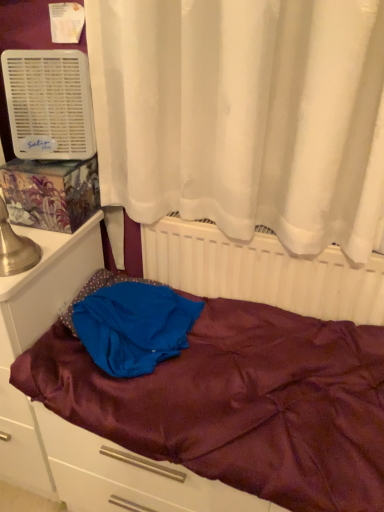
Question: Is white plastic air conditioner at upper left smaller than maroon satin bed at center?

Choices:
 (A) yes
 (B) no

Answer: (A)

Question: Can you confirm if white plastic air conditioner at upper left is taller than maroon satin bed at center?

Choices:
 (A) no
 (B) yes

Answer: (B)

Question: Is white plastic air conditioner at upper left at the right side of maroon satin bed at center?

Choices:
 (A) no
 (B) yes

Answer: (A)

Question: Is white plastic air conditioner at upper left at the left side of maroon satin bed at center?

Choices:
 (A) yes
 (B) no

Answer: (A)

Question: Is white plastic air conditioner at upper left oriented towards maroon satin bed at center?

Choices:
 (A) yes
 (B) no

Answer: (B)

Question: From the image's perspective, is white plastic radiator at center located above or below matte white file cabinet at left?

Choices:
 (A) above
 (B) below

Answer: (A)

Question: Relative to matte white file cabinet at left, is white plastic radiator at center in front or behind?

Choices:
 (A) behind
 (B) front

Answer: (A)

Question: Choose the correct answer: Is white plastic radiator at center inside matte white file cabinet at left or outside it?

Choices:
 (A) outside
 (B) inside

Answer: (A)

Question: From their relative heights in the image, would you say white plastic radiator at center is taller or shorter than matte white file cabinet at left?

Choices:
 (A) short
 (B) tall

Answer: (A)

Question: Do you think white plastic air conditioner at upper left is within blue satin blanket at center, or outside of it?

Choices:
 (A) inside
 (B) outside

Answer: (B)

Question: Is white plastic air conditioner at upper left in front of or behind blue satin blanket at center in the image?

Choices:
 (A) front
 (B) behind

Answer: (B)

Question: From the image's perspective, is white plastic air conditioner at upper left located above or below blue satin blanket at center?

Choices:
 (A) above
 (B) below

Answer: (A)

Question: Looking at their shapes, would you say white plastic air conditioner at upper left is wider or thinner than blue satin blanket at center?

Choices:
 (A) thin
 (B) wide

Answer: (A)

Question: In the image, is white plastic air conditioner at upper left positioned in front of or behind matte white file cabinet at left?

Choices:
 (A) behind
 (B) front

Answer: (A)

Question: Would you say white plastic air conditioner at upper left is inside or outside matte white file cabinet at left?

Choices:
 (A) outside
 (B) inside

Answer: (A)